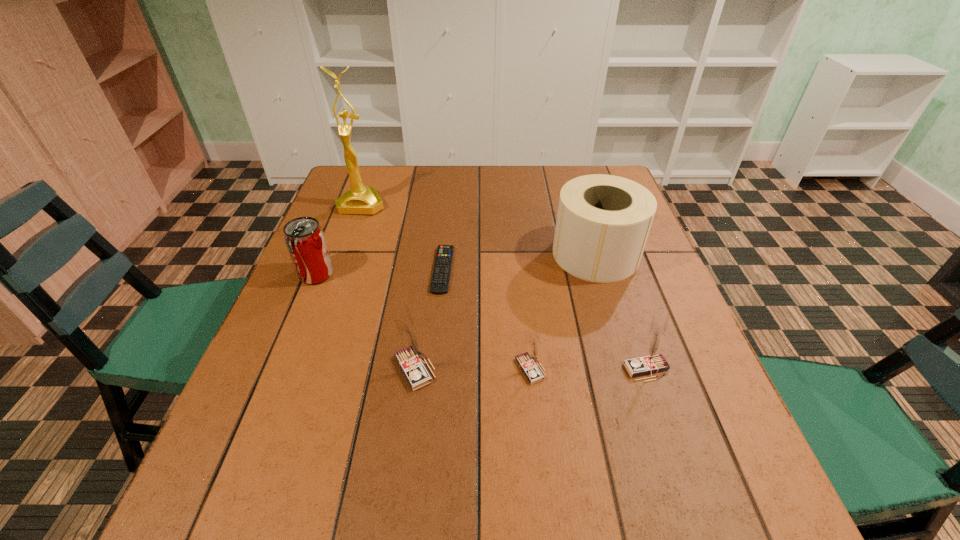
At what (x,y) coordinates should I click in order to perform the action: click on free space that satisfies the following two spatial constraints: 1. on the back side of the toilet tissue; 2. on the right side of the leftmost matchbox. Please return your answer as a coordinate pair (x, y). The image size is (960, 540). Looking at the image, I should click on (430, 254).

Locate an element on the screen. free space that satisfies the following two spatial constraints: 1. on the front-facing side of the award; 2. on the left side of the rightmost matchbox is located at coordinates (301, 369).

The width and height of the screenshot is (960, 540). Identify the location of free point that satisfies the following two spatial constraints: 1. on the front-facing side of the tallest object; 2. on the left side of the second shortest matchbox. (301, 369).

In order to click on vacant area that satisfies the following two spatial constraints: 1. on the front-facing side of the farthest object; 2. on the right side of the sixth tallest object in this screenshot , I will do `click(301, 369)`.

Image resolution: width=960 pixels, height=540 pixels. Identify the location of blank space that satisfies the following two spatial constraints: 1. on the front side of the pop soda; 2. on the right side of the second matchbox from right to left. (276, 369).